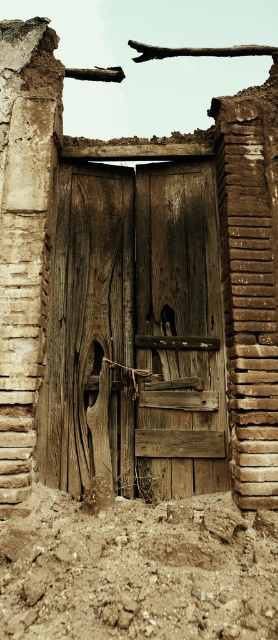
You are a construction worker assessing the stability of the weathered wood door at center and the brown sandy soil at lower center. Based on their proximity, can you determine if the door is at risk of sinking into the soil? Please provide your reasoning.

The weathered wood door at center is only 31.87 inches from the brown sandy soil at lower center. This close proximity suggests that the door could be at risk of sinking into the soil over time, especially if the soil becomes compacted or if there is water erosion affecting the structure.

You are a painter who wants to paint the weathered wood door at center and the brown sandy soil at lower center. Which object should you focus on first if you want to paint the larger one first?

The weathered wood door at center is bigger than the brown sandy soil at lower center, so you should focus on painting the weathered wood door at center first.

You are standing in front of the aged wooden door within the ruined brick structure. The door is slightly ajar, and you notice a coordinate system marked on the ground. According to the coordinates, where exactly is the weathered wood door at center positioned?

The weathered wood door at center is located at point (137, 330), as specified in the coordinates.